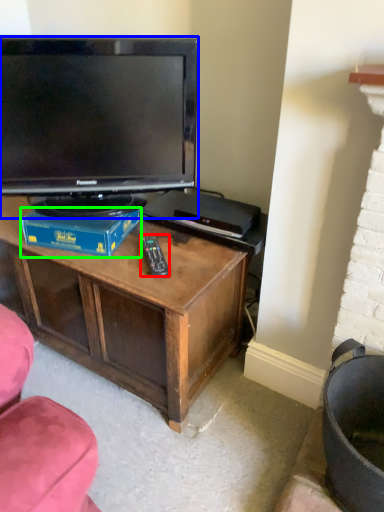
Question: Considering the real-world distances, which object is closest to remote (highlighted by a red box)? television (highlighted by a blue box) or book (highlighted by a green box).

Choices:
 (A) television
 (B) book

Answer: (B)